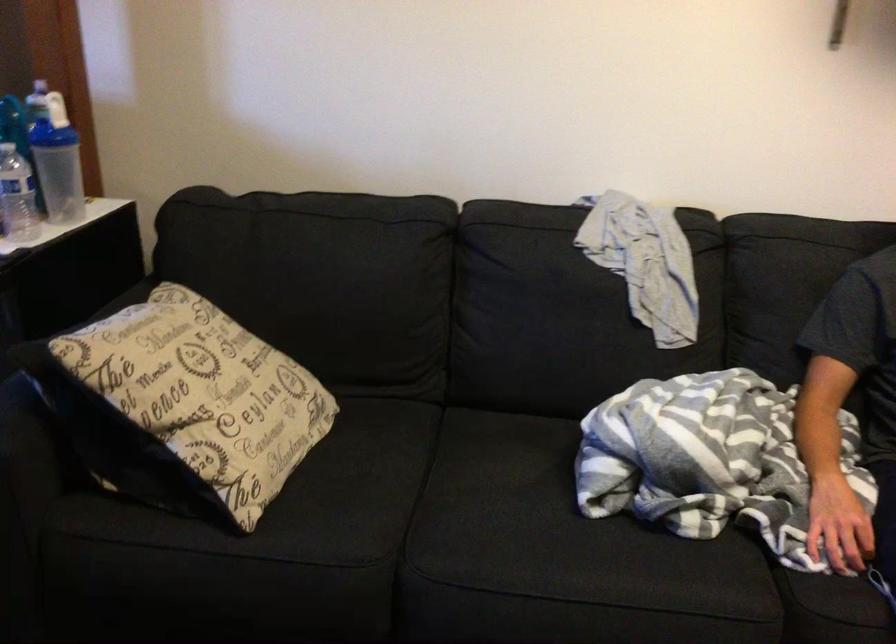
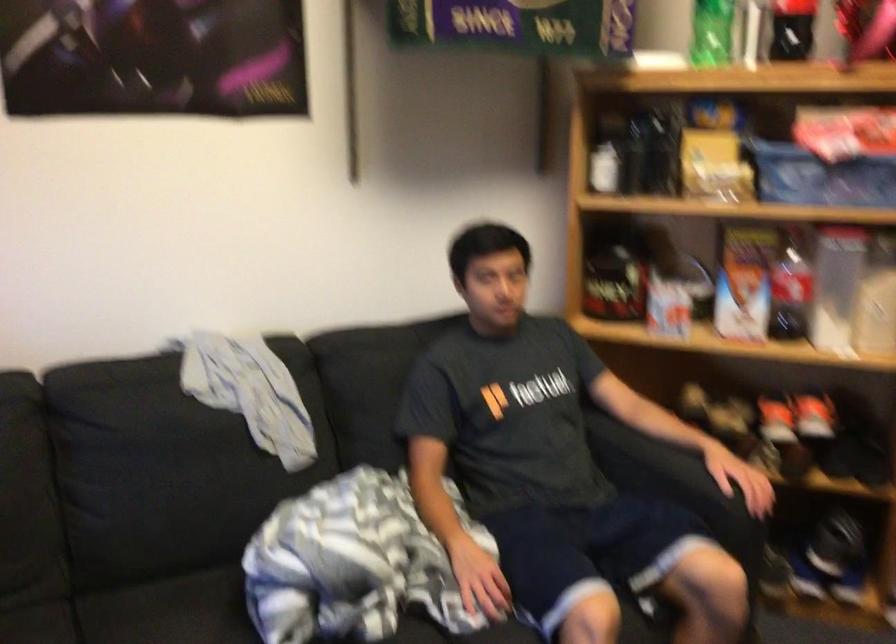
Locate, in the second image, the point that corresponds to pixel 512 440 in the first image.

(169, 611)